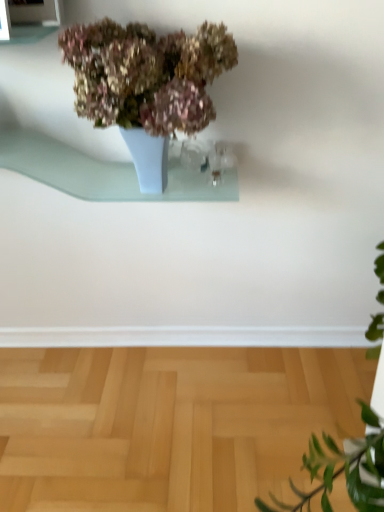
Question: Is light blue glass shelf at upper center wider than light wood parquet floor at lower center?

Choices:
 (A) no
 (B) yes

Answer: (A)

Question: From the image's perspective, is light blue glass shelf at upper center below light wood parquet floor at lower center?

Choices:
 (A) no
 (B) yes

Answer: (A)

Question: Is light wood parquet floor at lower center inside light blue glass shelf at upper center?

Choices:
 (A) no
 (B) yes

Answer: (A)

Question: Is light blue glass shelf at upper center at the left side of light wood parquet floor at lower center?

Choices:
 (A) yes
 (B) no

Answer: (A)

Question: From the image's perspective, is light blue glass shelf at upper center on top of light wood parquet floor at lower center?

Choices:
 (A) no
 (B) yes

Answer: (B)

Question: Can you confirm if light blue glass shelf at upper center is positioned to the right of light wood parquet floor at lower center?

Choices:
 (A) yes
 (B) no

Answer: (B)

Question: From a real-world perspective, is light wood parquet floor at lower center below matte ceramic vase at upper center?

Choices:
 (A) no
 (B) yes

Answer: (B)

Question: Is light wood parquet floor at lower center outside of matte ceramic vase at upper center?

Choices:
 (A) yes
 (B) no

Answer: (A)

Question: Is light wood parquet floor at lower center behind matte ceramic vase at upper center?

Choices:
 (A) no
 (B) yes

Answer: (B)

Question: Is matte ceramic vase at upper center surrounded by light wood parquet floor at lower center?

Choices:
 (A) yes
 (B) no

Answer: (B)

Question: Considering the relative sizes of light wood parquet floor at lower center and matte ceramic vase at upper center in the image provided, is light wood parquet floor at lower center wider than matte ceramic vase at upper center?

Choices:
 (A) no
 (B) yes

Answer: (B)

Question: Does light wood parquet floor at lower center have a larger size compared to matte ceramic vase at upper center?

Choices:
 (A) no
 (B) yes

Answer: (B)

Question: Is matte ceramic vase at upper center outside of light wood parquet floor at lower center?

Choices:
 (A) yes
 (B) no

Answer: (A)